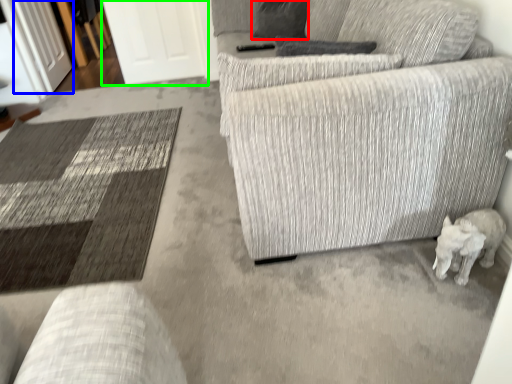
Question: Which object is positioned closest to pillow (highlighted by a red box)? Select from glass door (highlighted by a blue box) and glass door (highlighted by a green box).

Choices:
 (A) glass door
 (B) glass door

Answer: (B)